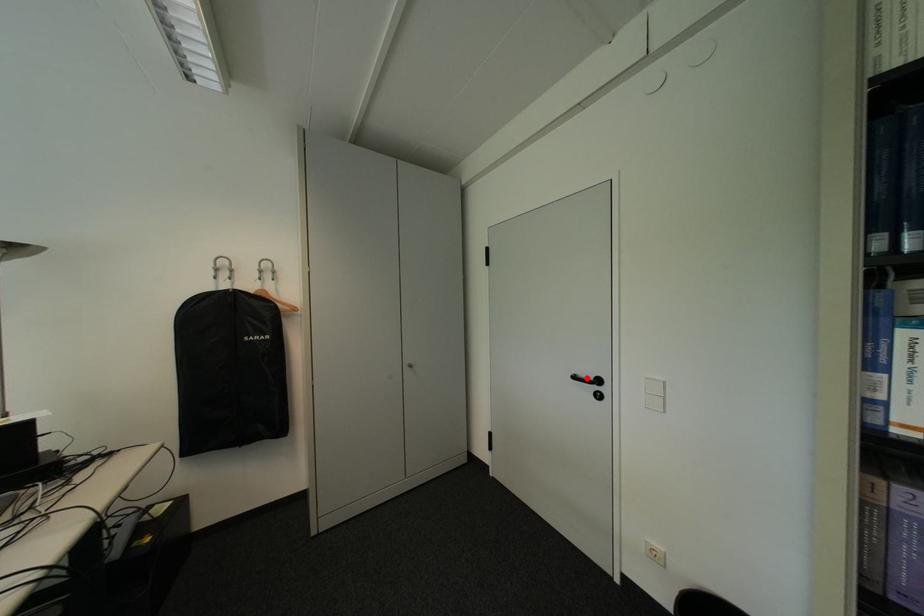
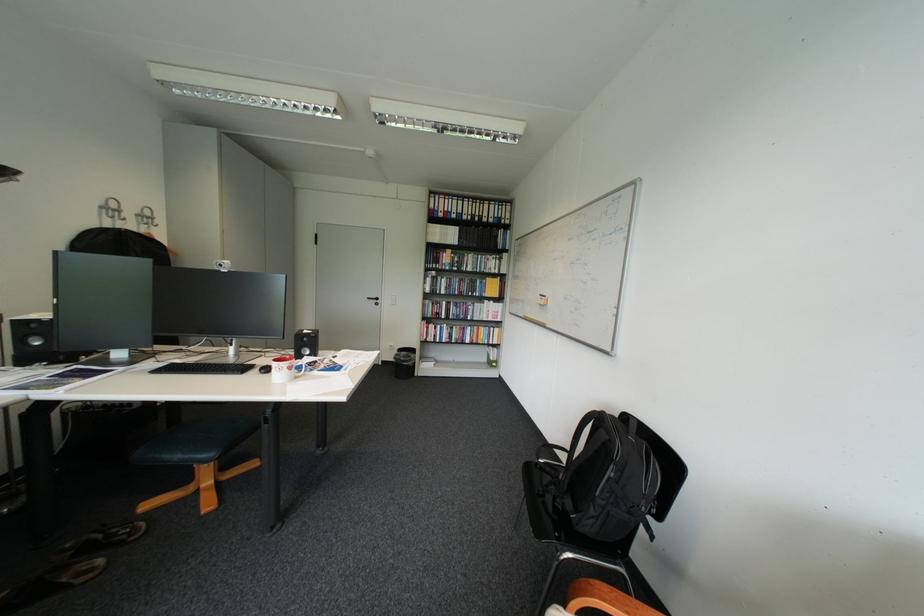
Where in the second image is the point corresponding to the highlighted location from the first image?

(381, 299)